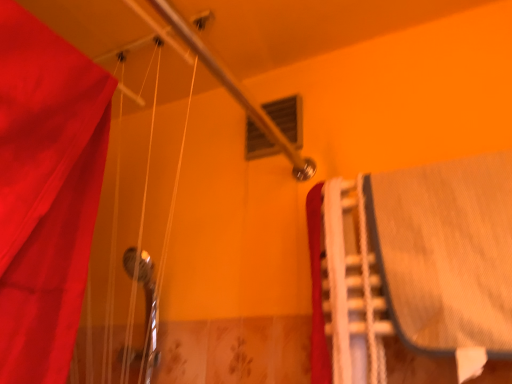
This screenshot has width=512, height=384. Find the location of `denim bed at right`. denim bed at right is located at coordinates (411, 265).

Image resolution: width=512 pixels, height=384 pixels. Describe the element at coordinates (411, 265) in the screenshot. I see `denim bed at right` at that location.

Image resolution: width=512 pixels, height=384 pixels. I want to click on matte plastic window at upper center, so click(287, 117).

Is denim bed at right positioned with its back to matte plastic window at upper center?

Result: No, denim bed at right is not facing away from matte plastic window at upper center.

Which object is wider, denim bed at right or matte plastic window at upper center?

Wider between the two is denim bed at right.

Between denim bed at right and matte plastic window at upper center, which one is positioned in front?

Positioned in front is denim bed at right.

What's the angular difference between matte plastic window at upper center and denim bed at right's facing directions?

0.287 degrees separate the facing orientations of matte plastic window at upper center and denim bed at right.

In the scene shown: From the image's perspective, is matte plastic window at upper center above or below denim bed at right?

Clearly, from the image's perspective, matte plastic window at upper center is above denim bed at right.

Which is behind, point (295, 94) or point (345, 310)?

The point (295, 94) is farther.

Is matte plastic window at upper center looking in the opposite direction of denim bed at right?

No, denim bed at right is not at the back of matte plastic window at upper center.

What's the angular difference between matte plastic window at upper center and white plastic stairs at right's facing directions?

There is a 0.285-degree angle between the facing directions of matte plastic window at upper center and white plastic stairs at right.

Can we say matte plastic window at upper center lies outside white plastic stairs at right?

matte plastic window at upper center is positioned outside white plastic stairs at right.

Which object is thinner, matte plastic window at upper center or white plastic stairs at right?

With smaller width is matte plastic window at upper center.

Considering the relative sizes of matte plastic window at upper center and white plastic stairs at right in the image provided, is matte plastic window at upper center shorter than white plastic stairs at right?

Yes.

From the image's perspective, is white plastic stairs at right located beneath matte plastic window at upper center?

Yes, from the image's perspective, white plastic stairs at right is below matte plastic window at upper center.

Choose the correct answer: Is white plastic stairs at right inside matte plastic window at upper center or outside it?

white plastic stairs at right cannot be found inside matte plastic window at upper center.

Considering the points (351, 187) and (255, 145), which point is in front, point (351, 187) or point (255, 145)?

Point (351, 187)

Can you tell me how much white plastic stairs at right and matte plastic window at upper center differ in facing direction?

The angle between the facing direction of white plastic stairs at right and the facing direction of matte plastic window at upper center is 0.285 degrees.

Does denim bed at right contain white plastic stairs at right?

Yes, white plastic stairs at right is a part of denim bed at right.

How much distance is there between denim bed at right and white plastic stairs at right?

A distance of 1.95 inches exists between denim bed at right and white plastic stairs at right.

Consider the image. Considering the sizes of objects denim bed at right and white plastic stairs at right in the image provided, who is bigger, denim bed at right or white plastic stairs at right?

denim bed at right is bigger.

Is denim bed at right next to white plastic stairs at right?

Yes.

Is white plastic stairs at right oriented towards denim bed at right?

Yes, white plastic stairs at right is aimed at denim bed at right.

Looking at the image, does white plastic stairs at right seem bigger or smaller compared to denim bed at right?

Clearly, white plastic stairs at right is smaller in size than denim bed at right.

Would you say white plastic stairs at right is inside or outside denim bed at right?

white plastic stairs at right is inside denim bed at right.

Can you confirm if white plastic stairs at right is wider than denim bed at right?

Incorrect, the width of white plastic stairs at right does not surpass that of denim bed at right.

I want to click on bed on the right of matte plastic window at upper center, so click(411, 265).

Find the location of `bed that is in front of the matte plastic window at upper center`. bed that is in front of the matte plastic window at upper center is located at coordinates (411, 265).

When comparing their distances from matte plastic window at upper center, does white plastic stairs at right or denim bed at right seem further?

Among the two, denim bed at right is located further to matte plastic window at upper center.

Which object lies nearer to the anchor point white plastic stairs at right, denim bed at right or matte plastic window at upper center?

denim bed at right.

Considering their positions, is white plastic stairs at right positioned further to denim bed at right than matte plastic window at upper center?

matte plastic window at upper center lies further to denim bed at right than the other object.

Considering their positions, is matte plastic window at upper center positioned further to denim bed at right than white plastic stairs at right?

matte plastic window at upper center lies further to denim bed at right than the other object.

In the scene shown: Considering their positions, is matte plastic window at upper center positioned closer to white plastic stairs at right than denim bed at right?

denim bed at right.

Which object lies further to the anchor point matte plastic window at upper center, denim bed at right or white plastic stairs at right?

denim bed at right.

I want to click on stair between denim bed at right and matte plastic window at upper center from front to back, so click(352, 289).